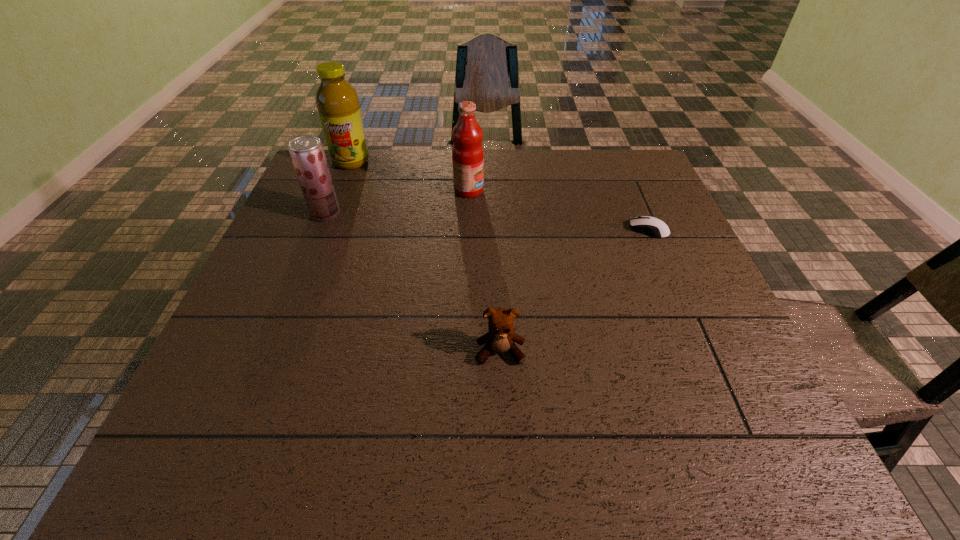
Locate an element on the screen. blank region between the shortest fruit juice and the mouse is located at coordinates (487, 221).

Find the location of a particular element. Image resolution: width=960 pixels, height=540 pixels. free spot between the nearest object and the farthest fruit juice is located at coordinates (425, 256).

Locate an element on the screen. The image size is (960, 540). object that stands as the second closest to the teddy bear is located at coordinates (467, 153).

This screenshot has height=540, width=960. Identify the location of object that stands as the fourth closest to the farthest object. (651, 226).

Identify which fruit juice is the closest to the rightmost object. Please provide its 2D coordinates. Your answer should be formatted as a tuple, i.e. [(x, y)], where the tuple contains the x and y coordinates of a point satisfying the conditions above.

[(467, 153)]

Identify which fruit juice is located as the nearest to the second farthest fruit juice. Please provide its 2D coordinates. Your answer should be formatted as a tuple, i.e. [(x, y)], where the tuple contains the x and y coordinates of a point satisfying the conditions above.

[(337, 101)]

Identify the location of vacant point that satisfies the following two spatial constraints: 1. on the front side of the rightmost object; 2. on the left side of the shortest fruit juice. This screenshot has width=960, height=540. (319, 230).

Find the location of a particular element. free location that satisfies the following two spatial constraints: 1. on the front label of the shortest object; 2. on the left side of the second nearest fruit juice is located at coordinates (468, 230).

Locate an element on the screen. The width and height of the screenshot is (960, 540). free space that satisfies the following two spatial constraints: 1. on the front label of the rightmost object; 2. on the left side of the farthest object is located at coordinates (324, 230).